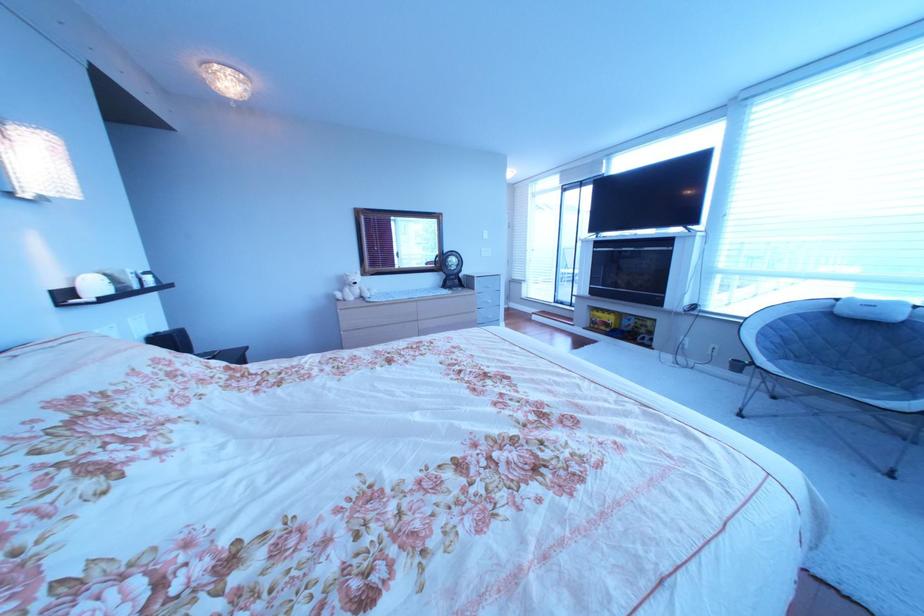
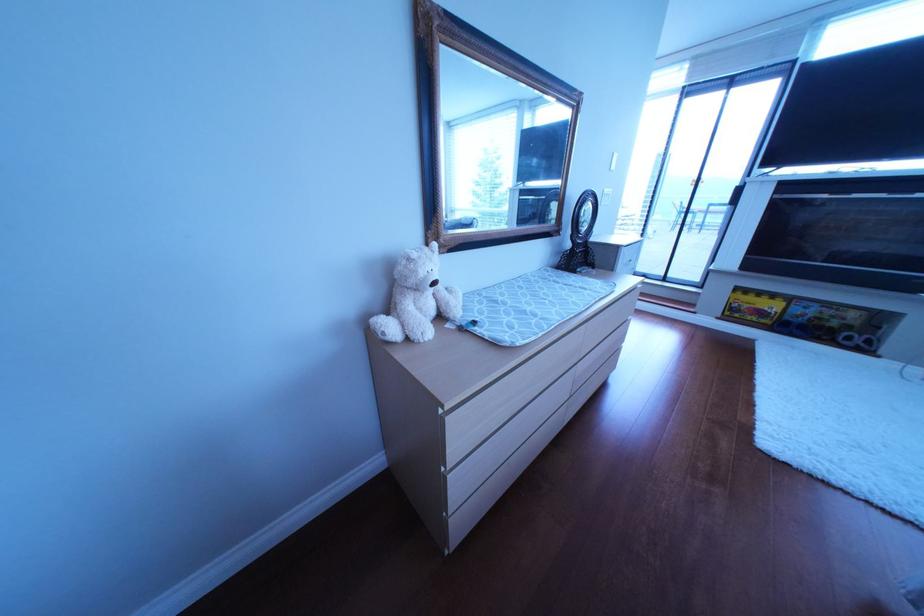
Which direction would the cameraman need to move to produce the second image?

The movement direction of the cameraman is left, forward.